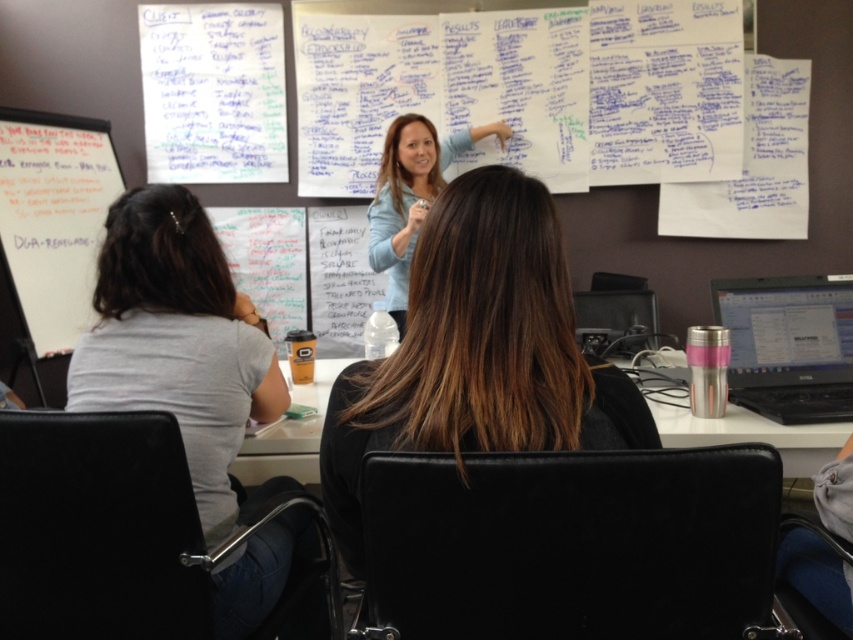
Question: Can you confirm if gray cotton shirt at left is thinner than metallic silver cup at center?

Choices:
 (A) no
 (B) yes

Answer: (A)

Question: Does brown hair at center have a larger size compared to light blue sweater at upper center?

Choices:
 (A) no
 (B) yes

Answer: (A)

Question: Is gray cotton shirt at left bigger than silver metallic laptop at right?

Choices:
 (A) yes
 (B) no

Answer: (A)

Question: Estimate the real-world distances between objects in this image. Which object is farther from the light blue sweater at upper center?

Choices:
 (A) brown hair at center
 (B) gray cotton shirt at left

Answer: (A)

Question: Considering the real-world distances, which object is farthest from the silver metallic laptop at right?

Choices:
 (A) brown hair at center
 (B) light blue sweater at upper center
 (C) whiteboard at left
 (D) metallic silver cup at center

Answer: (C)

Question: Which of the following is the closest to the observer?

Choices:
 (A) (807, 419)
 (B) (399, 289)

Answer: (A)